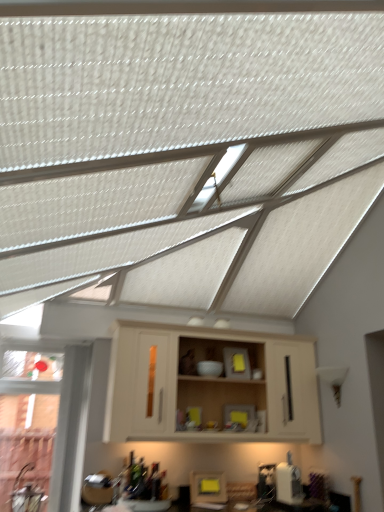
What do you see at coordinates (207, 487) in the screenshot? I see `yellow matte frame at lower center` at bounding box center [207, 487].

Locate an element on the screen. The image size is (384, 512). yellow matte frame at lower center is located at coordinates (207, 487).

What do you see at coordinates (207, 385) in the screenshot?
I see `beige wood cabinet at center` at bounding box center [207, 385].

Image resolution: width=384 pixels, height=512 pixels. Identify the location of beige wood cabinet at center. click(207, 385).

At what (x,y) coordinates should I click in order to perform the action: click on yellow matte frame at lower center. Please return your answer as a coordinate pair (x, y). Looking at the image, I should click on (207, 487).

In the image, is beige wood cabinet at center on the left side or the right side of yellow matte frame at lower center?

In the image, beige wood cabinet at center appears on the right side of yellow matte frame at lower center.

Is beige wood cabinet at center in front of or behind yellow matte frame at lower center in the image?

beige wood cabinet at center is positioned closer to the viewer than yellow matte frame at lower center.

Which is behind, point (289, 347) or point (214, 500)?

The point (289, 347) is farther from the camera.

From the image's perspective, would you say beige wood cabinet at center is shown under yellow matte frame at lower center?

No.

From a real-world perspective, is beige wood cabinet at center under yellow matte frame at lower center?

No, from a real-world perspective, beige wood cabinet at center is not below yellow matte frame at lower center.

Between beige wood cabinet at center and yellow matte frame at lower center, which one has larger width?

Wider between the two is beige wood cabinet at center.

Who is shorter, beige wood cabinet at center or yellow matte frame at lower center?

Standing shorter between the two is yellow matte frame at lower center.

Considering the relative sizes of beige wood cabinet at center and yellow matte frame at lower center in the image provided, is beige wood cabinet at center smaller than yellow matte frame at lower center?

Actually, beige wood cabinet at center might be larger than yellow matte frame at lower center.

Is beige wood cabinet at center spatially inside yellow matte frame at lower center, or outside of it?

beige wood cabinet at center is not enclosed by yellow matte frame at lower center.

Would you say beige wood cabinet at center is a long distance from yellow matte frame at lower center?

Actually, beige wood cabinet at center and yellow matte frame at lower center are a little close together.

Is beige wood cabinet at center looking in the opposite direction of yellow matte frame at lower center?

beige wood cabinet at center is not turned away from yellow matte frame at lower center.

Where is `cabinetry that appears in front of the yellow matte frame at lower center`? This screenshot has height=512, width=384. cabinetry that appears in front of the yellow matte frame at lower center is located at coordinates (207, 385).

Is yellow matte frame at lower center at the left side of beige wood cabinet at center?

Indeed, yellow matte frame at lower center is positioned on the left side of beige wood cabinet at center.

Based on the photo, considering their positions, is yellow matte frame at lower center located in front of or behind beige wood cabinet at center?

Clearly, yellow matte frame at lower center is behind beige wood cabinet at center.

Does point (210, 500) come behind point (108, 404)?

Yes, it is.

From the image's perspective, would you say yellow matte frame at lower center is shown under beige wood cabinet at center?

Indeed, from the image's perspective, yellow matte frame at lower center is shown beneath beige wood cabinet at center.

From a real-world perspective, is yellow matte frame at lower center physically located above or below beige wood cabinet at center?

yellow matte frame at lower center is situated lower than beige wood cabinet at center in the real world.

Between yellow matte frame at lower center and beige wood cabinet at center, which one has smaller width?

With smaller width is yellow matte frame at lower center.

Which of these two, yellow matte frame at lower center or beige wood cabinet at center, stands taller?

beige wood cabinet at center.

Based on their sizes in the image, would you say yellow matte frame at lower center is bigger or smaller than beige wood cabinet at center?

yellow matte frame at lower center is smaller than beige wood cabinet at center.

Is yellow matte frame at lower center located outside beige wood cabinet at center?

Yes, yellow matte frame at lower center is not within beige wood cabinet at center.

Is yellow matte frame at lower center not close to beige wood cabinet at center?

No, yellow matte frame at lower center is not far away from beige wood cabinet at center.

Based on the photo, could you tell me if yellow matte frame at lower center is turned towards beige wood cabinet at center?

No.

At what (x,y) coordinates should I click in order to perform the action: click on cabinetry that is on the right side of yellow matte frame at lower center. Please return your answer as a coordinate pair (x, y). This screenshot has height=512, width=384. Looking at the image, I should click on (207, 385).

Find the location of a particular element. This screenshot has height=512, width=384. appliance behind the beige wood cabinet at center is located at coordinates point(207,487).

Locate an element on the screen. cabinetry on the right of yellow matte frame at lower center is located at coordinates (207, 385).